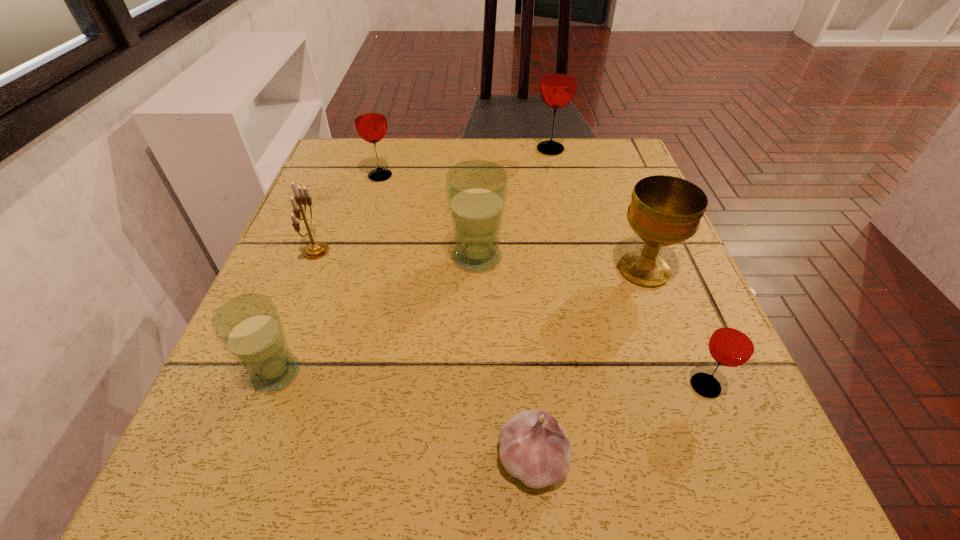
Where is `free area in between the leftmost red glass and the chalice`? Image resolution: width=960 pixels, height=540 pixels. free area in between the leftmost red glass and the chalice is located at coordinates (512, 223).

At what (x,y) coordinates should I click in order to perform the action: click on free spot between the shortest object and the chalice. Please return your answer as a coordinate pair (x, y). Looking at the image, I should click on (588, 364).

The width and height of the screenshot is (960, 540). Identify the location of object that is the sixth nearest to the white garlic. tap(370, 121).

Find the location of a particular element. The height and width of the screenshot is (540, 960). object that is the nearest to the gold candelabrum is located at coordinates (370, 121).

Identify which glass is the fourth nearest to the gold candelabrum. Please provide its 2D coordinates. Your answer should be formatted as a tuple, i.e. [(x, y)], where the tuple contains the x and y coordinates of a point satisfying the conditions above.

[(558, 82)]

Identify which glass is the second nearest to the third glass from left to right. Please provide its 2D coordinates. Your answer should be formatted as a tuple, i.e. [(x, y)], where the tuple contains the x and y coordinates of a point satisfying the conditions above.

[(249, 327)]

I want to click on red glass that is the closest to the nearest red glass, so click(558, 82).

Locate an element on the screen. This screenshot has height=540, width=960. the closest red glass to the nearer blue glass is located at coordinates (370, 121).

At what (x,y) coordinates should I click in order to perform the action: click on free region that satisfies the following two spatial constraints: 1. on the back side of the farthest glass; 2. on the right side of the nearer blue glass. Please return your answer as a coordinate pair (x, y). Looking at the image, I should click on (361, 149).

The height and width of the screenshot is (540, 960). Find the location of `free space that satisfies the following two spatial constraints: 1. on the front side of the chalice; 2. on the left side of the biggest red glass`. free space that satisfies the following two spatial constraints: 1. on the front side of the chalice; 2. on the left side of the biggest red glass is located at coordinates (578, 270).